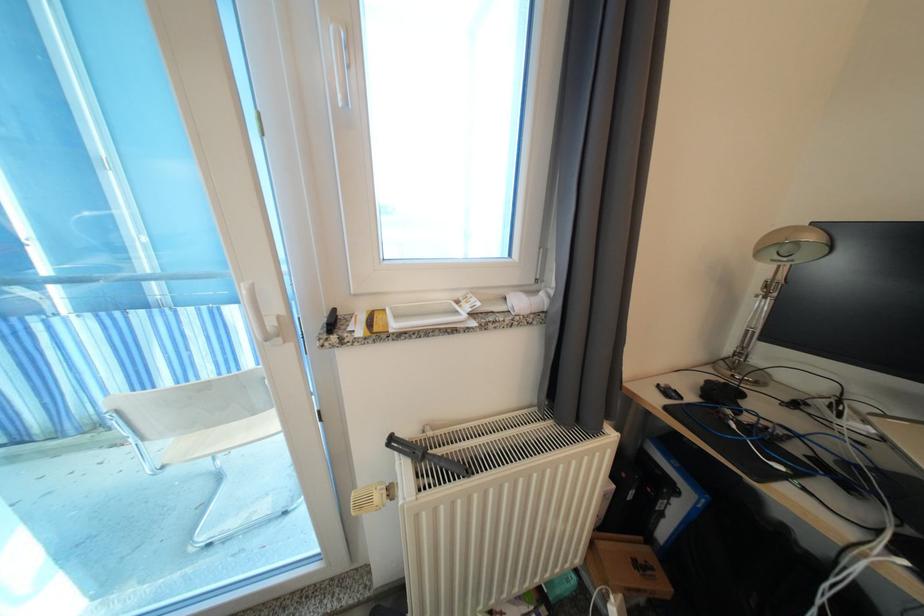
Where is `white window handle`? Image resolution: width=924 pixels, height=616 pixels. white window handle is located at coordinates (339, 63).